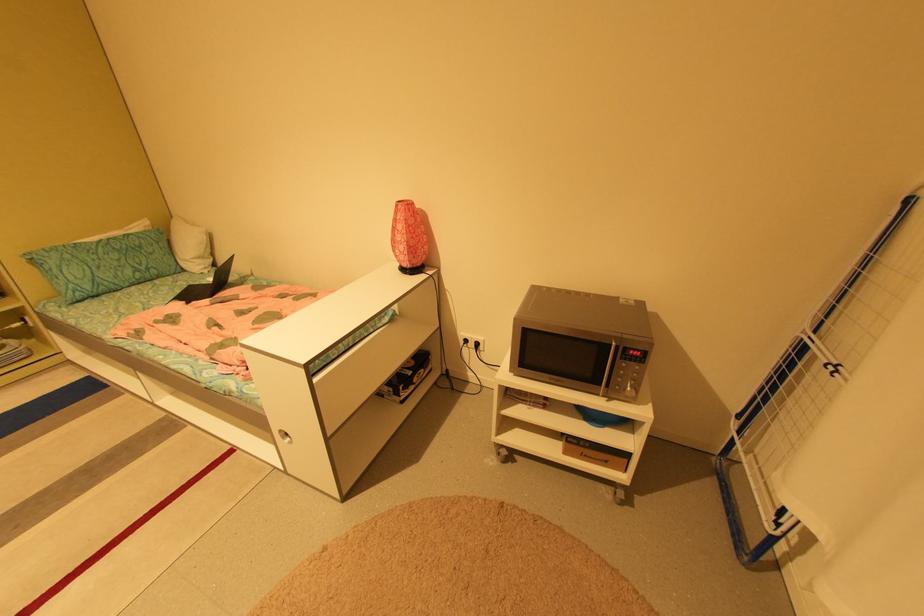
What do you see at coordinates (628, 391) in the screenshot? I see `the microwave push buttons` at bounding box center [628, 391].